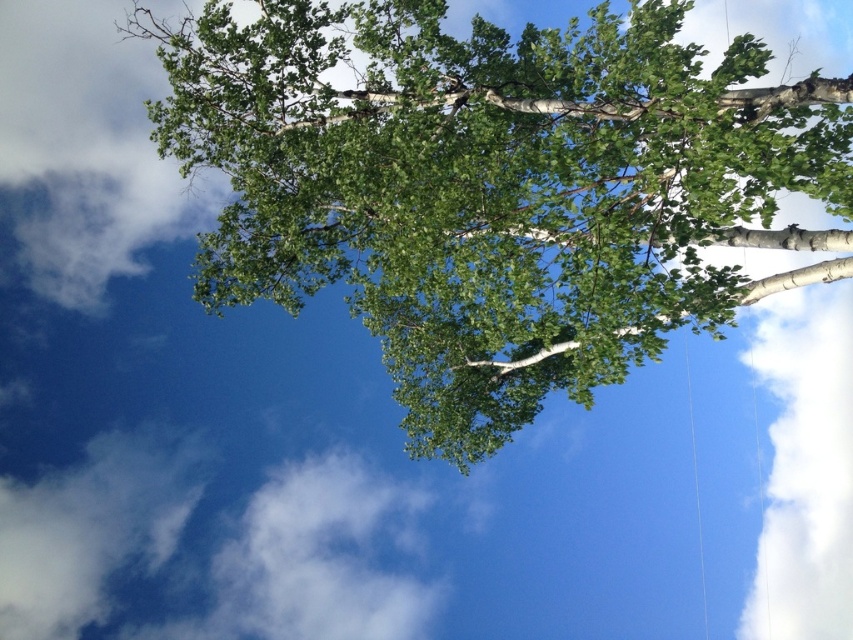
Question: Is green leafy tree at upper center bigger than white fluffy cloud at upper right?

Choices:
 (A) no
 (B) yes

Answer: (B)

Question: Is green leafy tree at upper center positioned before white fluffy cloud at lower left?

Choices:
 (A) no
 (B) yes

Answer: (B)

Question: Which point is farther to the camera?

Choices:
 (A) white fluffy cloud at lower left
 (B) white fluffy cloud at upper right
 (C) green leafy tree at upper center

Answer: (B)

Question: Which of the following is the farthest from the observer?

Choices:
 (A) (57, 602)
 (B) (206, 90)
 (C) (764, 376)

Answer: (C)

Question: Can you confirm if white fluffy cloud at upper right is positioned to the left of white fluffy cloud at lower left?

Choices:
 (A) no
 (B) yes

Answer: (A)

Question: Which object is farther from the camera taking this photo?

Choices:
 (A) green leafy tree at upper center
 (B) white fluffy cloud at lower left
 (C) white fluffy cloud at upper right

Answer: (C)